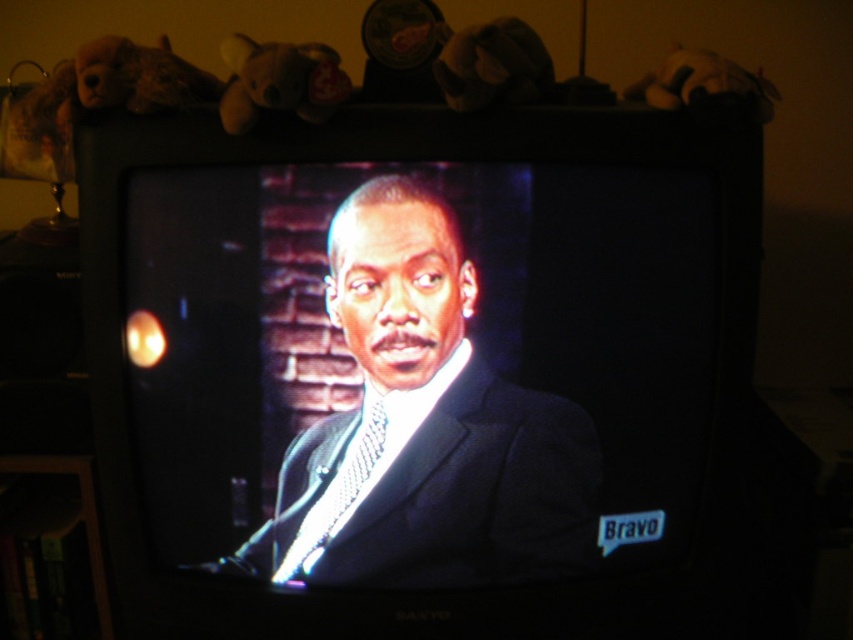
Measure the distance between matte black suit at center and shiny silver tie at center.

The distance of matte black suit at center from shiny silver tie at center is 2.64 inches.

Which is more to the right, matte black suit at center or shiny silver tie at center?

Positioned to the right is matte black suit at center.

The width and height of the screenshot is (853, 640). What do you see at coordinates (424, 428) in the screenshot?
I see `matte black suit at center` at bounding box center [424, 428].

The image size is (853, 640). What are the coordinates of `matte black suit at center` in the screenshot? It's located at (424, 428).